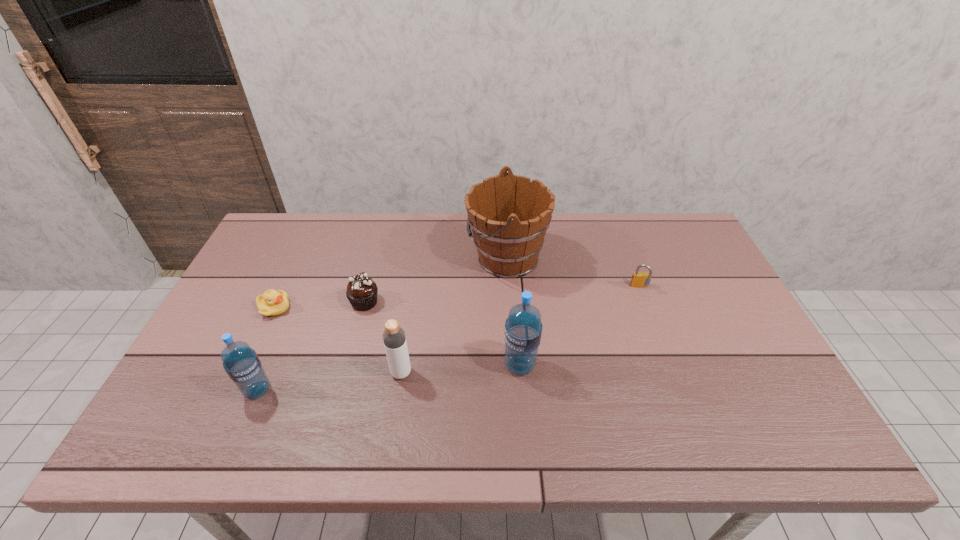
Where is `the left water bottle`? The width and height of the screenshot is (960, 540). the left water bottle is located at coordinates (241, 363).

Identify the location of the right water bottle. (523, 328).

Locate an element on the screen. wine bucket is located at coordinates (509, 215).

Identify the location of cupcake. The height and width of the screenshot is (540, 960). (361, 292).

Locate an element on the screen. the shortest object is located at coordinates (272, 303).

The height and width of the screenshot is (540, 960). What are the coordinates of `the rightmost object` in the screenshot? It's located at (639, 279).

Locate an element on the screen. This screenshot has height=540, width=960. bottle is located at coordinates (394, 339).

Identify the location of vacant region located on the back of the left water bottle. (306, 275).

At what (x,y) coordinates should I click in order to perform the action: click on free point located on the left of the taller water bottle. Please return your answer as a coordinate pair (x, y). The width and height of the screenshot is (960, 540). Looking at the image, I should click on (451, 365).

The height and width of the screenshot is (540, 960). I want to click on vacant region located 0.090m with the handle on the wine bucket, so click(438, 258).